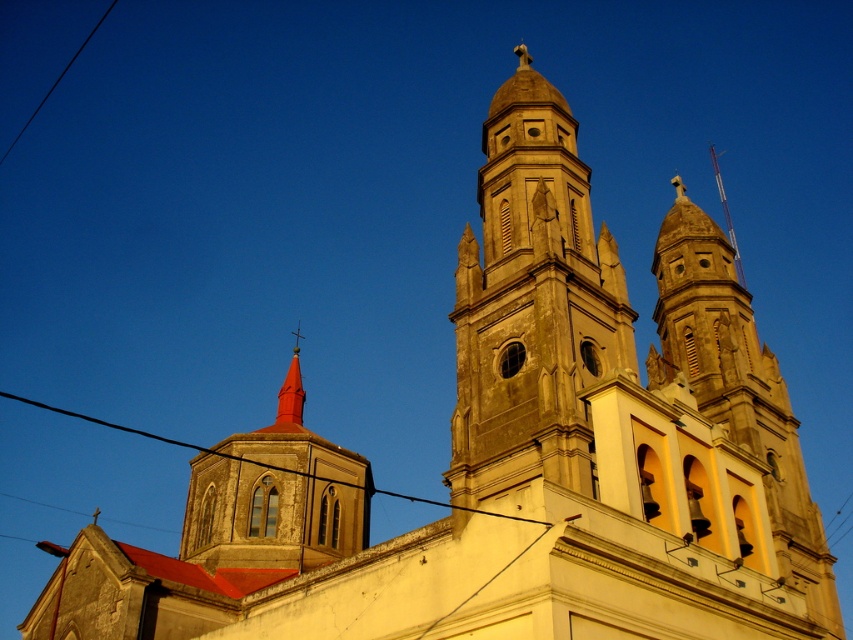
You are standing at the base of the church towers and want to take a photo of the point at coordinates point (x=531, y=278). Your camera has a maximum focus range of 50 meters. Will the camera be able to focus on that point?

The point (x=531, y=278) is 53.99 meters from the camera, which exceeds the maximum focus range of 50 meters. Therefore, the camera will not be able to focus on that point.

In the scene shown: You are standing at the point with coordinates 0.5, 0.5 in the image. Which direction should you move to reach the light beige stone tower at center?

The light beige stone tower at center is located at point (532, 304). Since you are at (426, 320), you should move slightly to the left and upwards to reach it.

You are standing in front of the church and notice two points marked on the towers. The first point is at coordinates point (468, 252) and the second is at point (294, 392). Which point is closer to you?

Point (468, 252) is in front of point (294, 392), so it is closer to you.